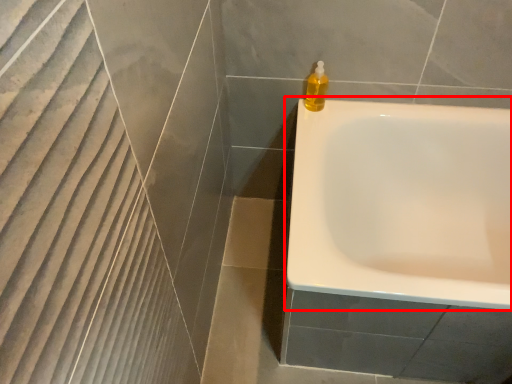
Question: From the image, what is the correct spatial relationship of bathtub (annotated by the red box) in relation to soap dispenser?

Choices:
 (A) left
 (B) right

Answer: (B)